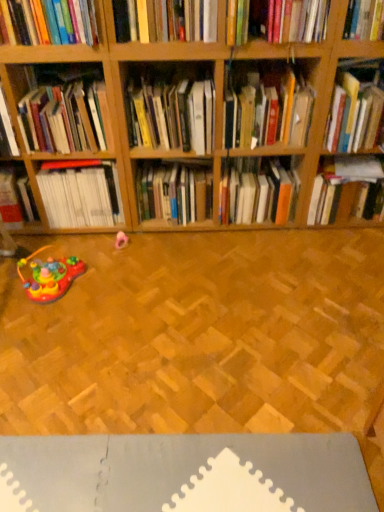
Locate an element on the screen. The height and width of the screenshot is (512, 384). free space to the back side of rubberized plastic toy at lower left, the second toy from the right is located at coordinates (77, 246).